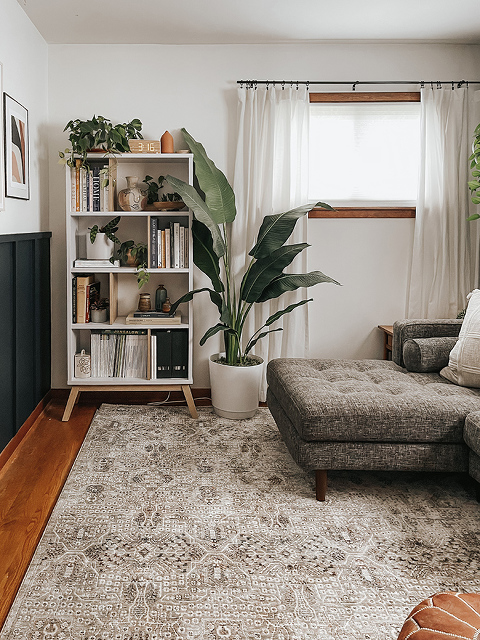
In order to click on seat in this screenshot , I will do pyautogui.click(x=456, y=619).